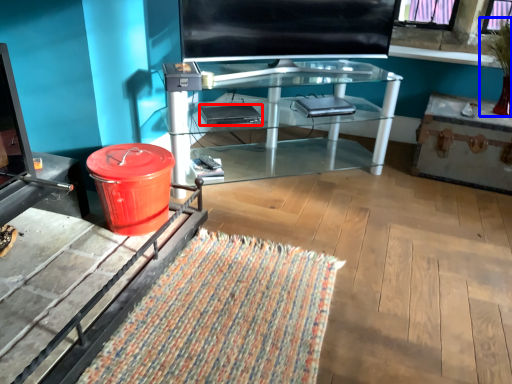
Question: Which of the following is the farthest to the observer, laptop (highlighted by a red box) or houseplant (highlighted by a blue box)?

Choices:
 (A) laptop
 (B) houseplant

Answer: (A)